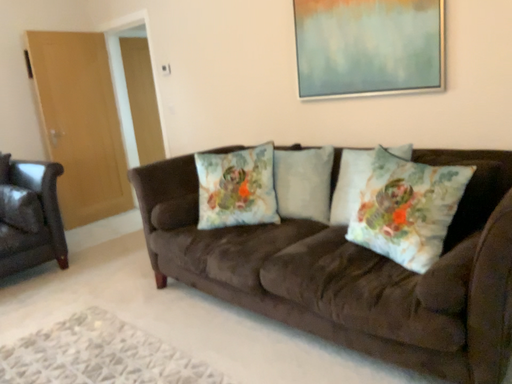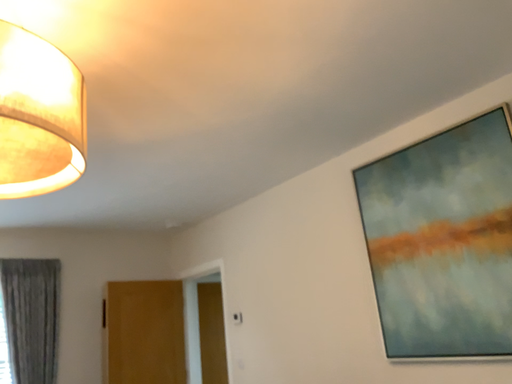
Question: How did the camera likely rotate when shooting the video?

Choices:
 (A) rotated downward
 (B) rotated upward

Answer: (B)